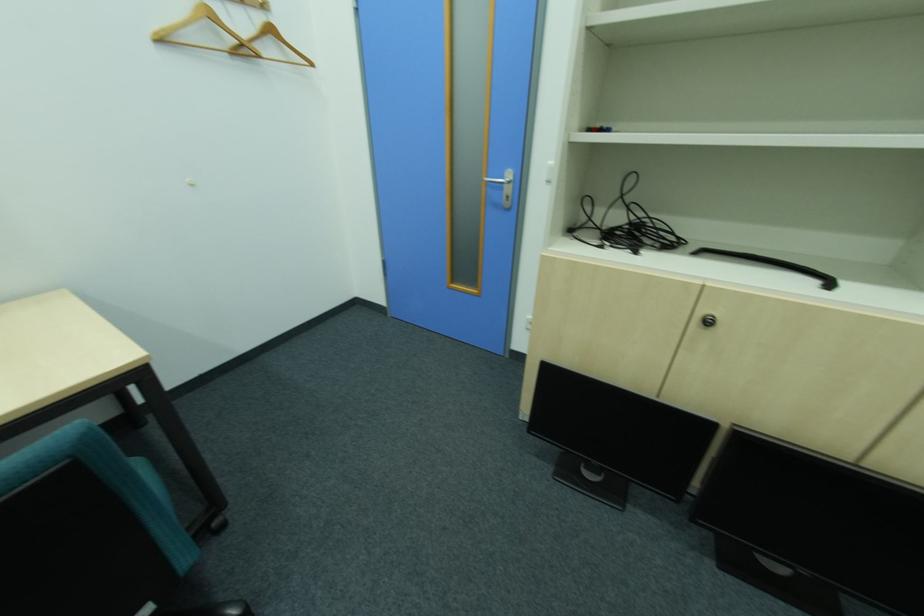
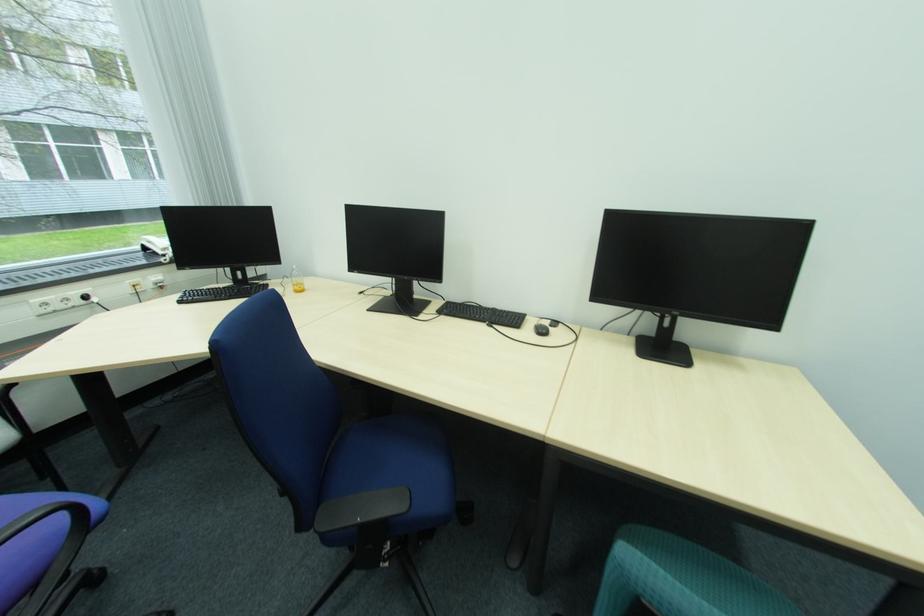
First-person continuous shooting, in which direction is the camera rotating?

The camera's rotation is toward left-down.